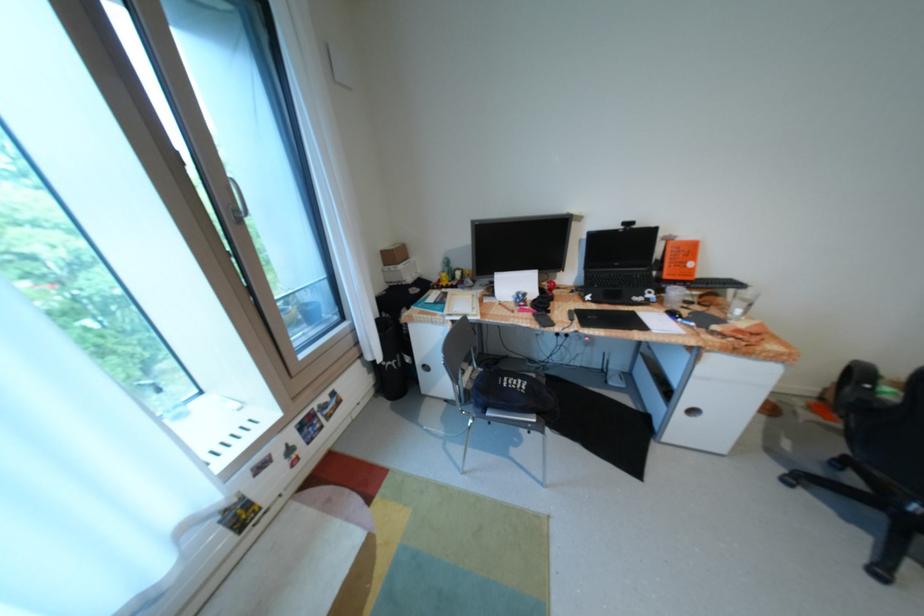
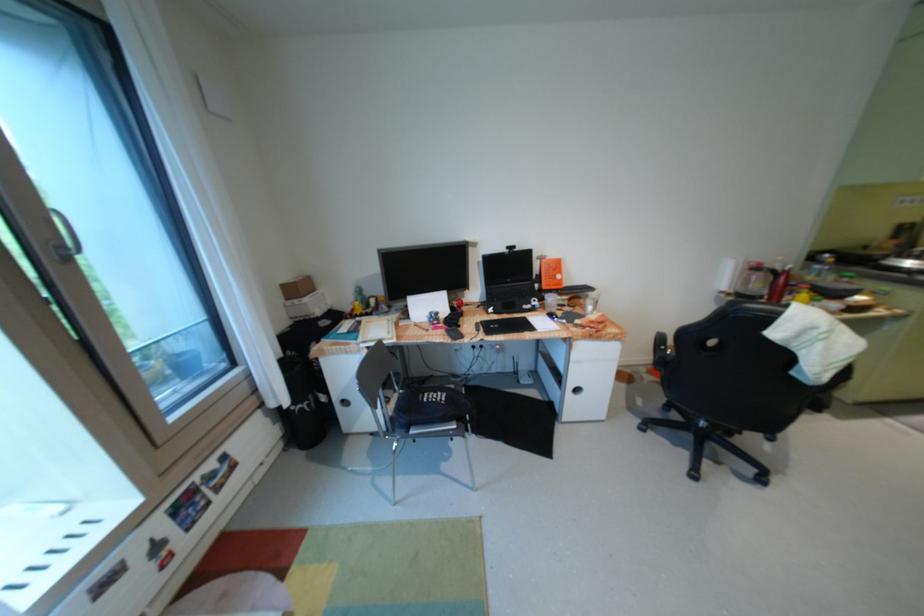
Locate, in the second image, the point that corresponds to pixel 247 211 in the first image.

(73, 248)